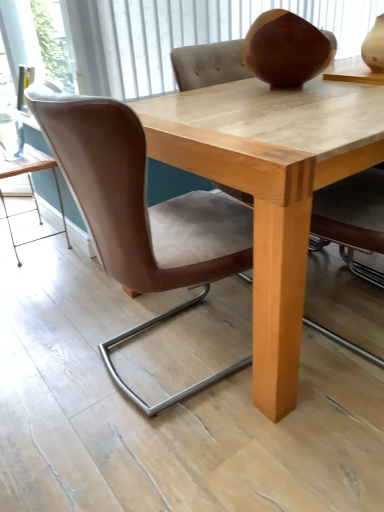
Image resolution: width=384 pixels, height=512 pixels. Describe the element at coordinates (53, 42) in the screenshot. I see `transparent glass door at upper left` at that location.

This screenshot has width=384, height=512. I want to click on transparent glass door at upper left, so click(x=53, y=42).

What is the approximate width of light brown wood table at lower left?

light brown wood table at lower left is 13.07 inches wide.

At what (x,y) coordinates should I click in order to perform the action: click on transparent glass door at upper left. Please return your answer as a coordinate pair (x, y). The width and height of the screenshot is (384, 512). Looking at the image, I should click on (53, 42).

From the image's perspective, which is below, transparent glass door at upper left or brown leather chair at center?

brown leather chair at center.

Considering the sizes of transparent glass door at upper left and brown leather chair at center in the image, is transparent glass door at upper left bigger or smaller than brown leather chair at center?

In the image, transparent glass door at upper left appears to be smaller than brown leather chair at center.

What are the coordinates of `glass door located above the brown leather chair at center (from the image's perspective)` in the screenshot? It's located at (53, 42).

Considering the sizes of objects transparent glass door at upper left and brown leather chair at center in the image provided, who is thinner, transparent glass door at upper left or brown leather chair at center?

With smaller width is transparent glass door at upper left.

Which is behind, light brown wood table at lower left or transparent glass door at upper left?

light brown wood table at lower left is further from the camera.

Is light brown wood table at lower left turned away from transparent glass door at upper left?

No, light brown wood table at lower left is not facing the opposite direction of transparent glass door at upper left.

From the image's perspective, which is below, light brown wood table at lower left or transparent glass door at upper left?

From the image's view, light brown wood table at lower left is below.

From a real-world perspective, is light brown wood table at lower left on top of transparent glass door at upper left?

Incorrect, from a real-world perspective, light brown wood table at lower left is lower than transparent glass door at upper left.

From the image's perspective, which one is positioned lower, brown leather chair at center or light brown wood table at lower left?

brown leather chair at center, from the image's perspective.

Consider the image. Which object is wider, brown leather chair at center or light brown wood table at lower left?

brown leather chair at center is wider.

Is brown leather chair at center touching light brown wood table at lower left?

No.

Is point (100, 176) behind point (44, 16)?

No, it is not.

Based on the photo, which is correct: brown leather chair at center is inside transparent glass door at upper left, or outside of it?

brown leather chair at center exists outside the volume of transparent glass door at upper left.

Which of these two, brown leather chair at center or transparent glass door at upper left, is thinner?

transparent glass door at upper left.

From the image's perspective, which is below, brown leather chair at center or transparent glass door at upper left?

brown leather chair at center appears lower in the image.

Between point (45, 42) and point (69, 244), which one is positioned in front?

Positioned in front is point (69, 244).

Considering the relative sizes of transparent glass door at upper left and light brown wood table at lower left in the image provided, is transparent glass door at upper left shorter than light brown wood table at lower left?

Indeed, transparent glass door at upper left has a lesser height compared to light brown wood table at lower left.

From a real-world perspective, is transparent glass door at upper left physically above light brown wood table at lower left?

Yes.

From the image's perspective, is transparent glass door at upper left on light brown wood table at lower left?

Yes, from the image's perspective, transparent glass door at upper left is on top of light brown wood table at lower left.

From the image's perspective, would you say light brown wood table at lower left is positioned over brown leather chair at center?

Yes, from the image's perspective, light brown wood table at lower left is over brown leather chair at center.

Can brown leather chair at center be found inside light brown wood table at lower left?

No, brown leather chair at center is not a part of light brown wood table at lower left.

Is light brown wood table at lower left next to brown leather chair at center?

No, light brown wood table at lower left is not touching brown leather chair at center.

Which object is closer to the camera, light brown wood table at lower left or brown leather chair at center?

brown leather chair at center is closer to the camera.

Where is `chair to the right of transparent glass door at upper left`? This screenshot has height=512, width=384. chair to the right of transparent glass door at upper left is located at coordinates point(140,213).

The height and width of the screenshot is (512, 384). I want to click on glass door lying above the light brown wood table at lower left (from the image's perspective), so click(x=53, y=42).

Which object lies nearer to the anchor point transparent glass door at upper left, brown leather chair at center or light brown wood table at lower left?

Based on the image, light brown wood table at lower left appears to be nearer to transparent glass door at upper left.

Considering their positions, is transparent glass door at upper left positioned closer to brown leather chair at center than light brown wood table at lower left?

light brown wood table at lower left.

Looking at the image, which one is located closer to light brown wood table at lower left, brown leather chair at center or transparent glass door at upper left?

transparent glass door at upper left.

From the picture: Considering their positions, is light brown wood table at lower left positioned closer to transparent glass door at upper left than brown leather chair at center?

The object closer to transparent glass door at upper left is light brown wood table at lower left.

Considering their positions, is transparent glass door at upper left positioned further to light brown wood table at lower left than brown leather chair at center?

brown leather chair at center is further to light brown wood table at lower left.

Looking at the image, which one is located closer to brown leather chair at center, light brown wood table at lower left or transparent glass door at upper left?

Based on the image, light brown wood table at lower left appears to be nearer to brown leather chair at center.

I want to click on glass door located between brown leather chair at center and light brown wood table at lower left in the depth direction, so click(53, 42).